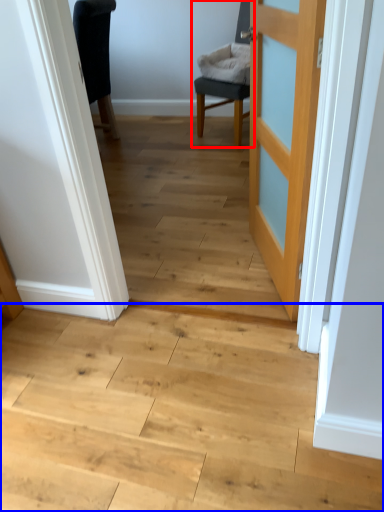
Question: Among these objects, which one is farthest to the camera, chair (highlighted by a red box) or stairwell (highlighted by a blue box)?

Choices:
 (A) chair
 (B) stairwell

Answer: (A)